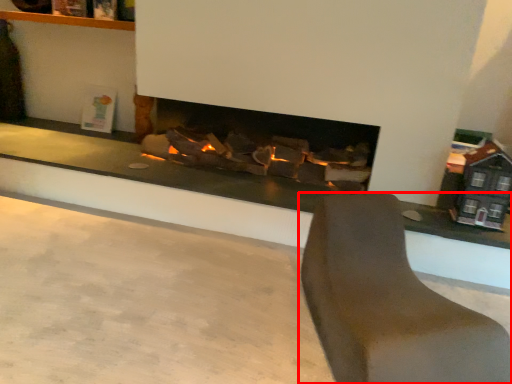
Question: Considering the relative positions of furniture (annotated by the red box) and concrete in the image provided, where is furniture (annotated by the red box) located with respect to the staircase?

Choices:
 (A) left
 (B) right

Answer: (B)